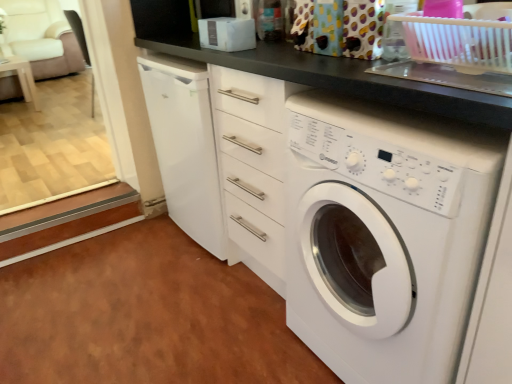
Question: Does white glossy washing machine at center have a smaller size compared to white fabric armchair at upper left?

Choices:
 (A) yes
 (B) no

Answer: (A)

Question: Does white glossy washing machine at center lie in front of white fabric armchair at upper left?

Choices:
 (A) no
 (B) yes

Answer: (B)

Question: Is white glossy washing machine at center wider than white fabric armchair at upper left?

Choices:
 (A) yes
 (B) no

Answer: (B)

Question: Is white glossy washing machine at center thinner than white fabric armchair at upper left?

Choices:
 (A) no
 (B) yes

Answer: (B)

Question: Does white glossy washing machine at center appear on the left side of white fabric armchair at upper left?

Choices:
 (A) no
 (B) yes

Answer: (A)

Question: From the image's perspective, is white fabric armchair at upper left located above or below white glossy table at left?

Choices:
 (A) below
 (B) above

Answer: (B)

Question: In the image, is white fabric armchair at upper left positioned in front of or behind white glossy table at left?

Choices:
 (A) front
 (B) behind

Answer: (B)

Question: Is white fabric armchair at upper left taller or shorter than white glossy table at left?

Choices:
 (A) tall
 (B) short

Answer: (A)

Question: Considering the positions of white fabric armchair at upper left and white glossy table at left in the image, is white fabric armchair at upper left bigger or smaller than white glossy table at left?

Choices:
 (A) small
 (B) big

Answer: (B)

Question: From a real-world perspective, is white glossy washing machine at center above or below white fabric armchair at upper left?

Choices:
 (A) above
 (B) below

Answer: (B)

Question: In terms of width, does white glossy washing machine at center look wider or thinner when compared to white fabric armchair at upper left?

Choices:
 (A) thin
 (B) wide

Answer: (A)

Question: In terms of size, does white glossy washing machine at center appear bigger or smaller than white fabric armchair at upper left?

Choices:
 (A) big
 (B) small

Answer: (B)

Question: Is white glossy washing machine at center taller or shorter than white fabric armchair at upper left?

Choices:
 (A) short
 (B) tall

Answer: (B)

Question: Is white glossy washing machine at center inside the boundaries of white glossy table at left, or outside?

Choices:
 (A) inside
 (B) outside

Answer: (B)

Question: Is white glossy washing machine at center bigger or smaller than white glossy table at left?

Choices:
 (A) big
 (B) small

Answer: (A)